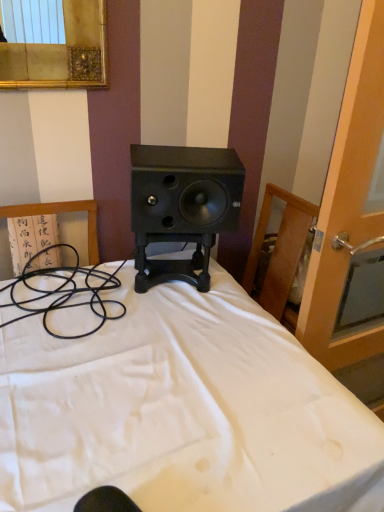
Question: Is transparent glass screen door at right located outside black matte speaker at center?

Choices:
 (A) yes
 (B) no

Answer: (A)

Question: Does transparent glass screen door at right have a smaller size compared to black matte speaker at center?

Choices:
 (A) yes
 (B) no

Answer: (B)

Question: Is transparent glass screen door at right at the left side of black matte speaker at center?

Choices:
 (A) no
 (B) yes

Answer: (A)

Question: Is transparent glass screen door at right positioned far away from black matte speaker at center?

Choices:
 (A) no
 (B) yes

Answer: (A)

Question: Considering the relative positions of transparent glass screen door at right and black matte speaker at center in the image provided, is transparent glass screen door at right to the right of black matte speaker at center from the viewer's perspective?

Choices:
 (A) no
 (B) yes

Answer: (B)

Question: From the image's perspective, would you say transparent glass screen door at right is positioned over black matte speaker at center?

Choices:
 (A) yes
 (B) no

Answer: (B)

Question: Does black matte speaker at center appear on the left side of transparent glass screen door at right?

Choices:
 (A) yes
 (B) no

Answer: (A)

Question: From a real-world perspective, is black matte speaker at center positioned over transparent glass screen door at right based on gravity?

Choices:
 (A) yes
 (B) no

Answer: (A)

Question: Is black matte speaker at center with transparent glass screen door at right?

Choices:
 (A) yes
 (B) no

Answer: (B)

Question: Is black matte speaker at center far from transparent glass screen door at right?

Choices:
 (A) no
 (B) yes

Answer: (A)

Question: Does black matte speaker at center lie in front of transparent glass screen door at right?

Choices:
 (A) no
 (B) yes

Answer: (A)

Question: Is transparent glass screen door at right at the back of black matte speaker at center?

Choices:
 (A) no
 (B) yes

Answer: (A)

Question: Is the depth of white matte bed at center greater than that of transparent glass screen door at right?

Choices:
 (A) yes
 (B) no

Answer: (B)